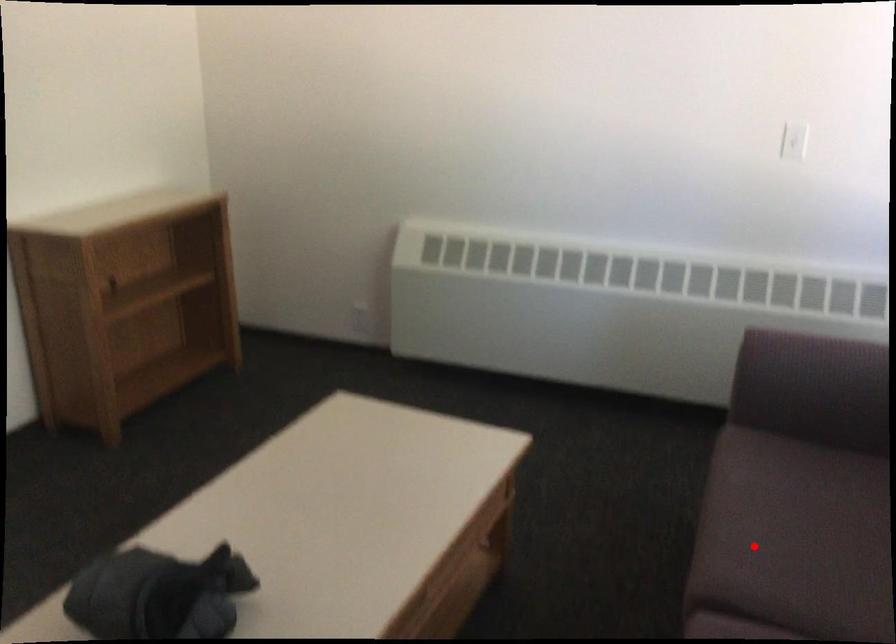
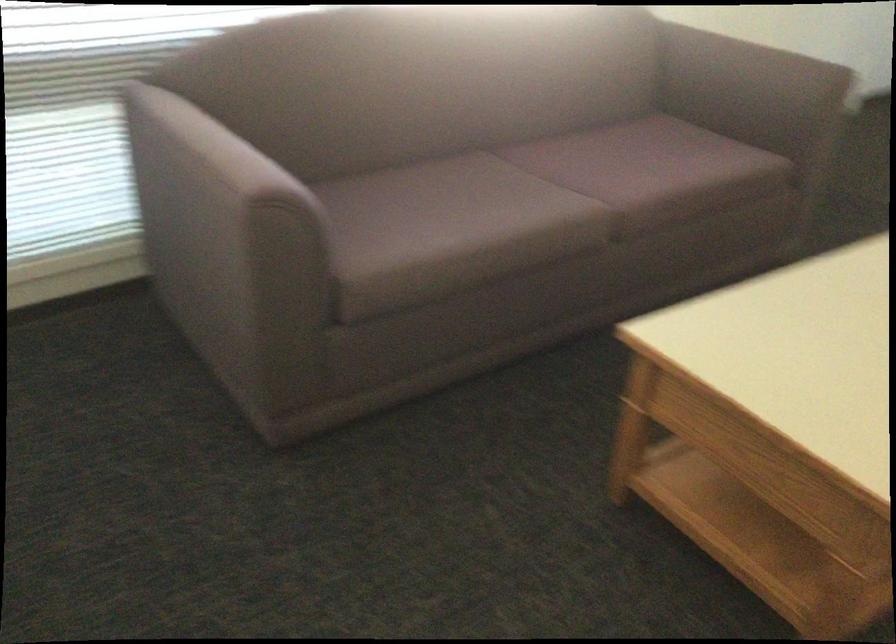
Question: I am providing you with two images of the same scene from different viewpoints. Given a red point in image1, look at the same physical point in image2. Is it:

Choices:
 (A) Closer to the viewpoint
 (B) Farther from the viewpoint

Answer: (B)